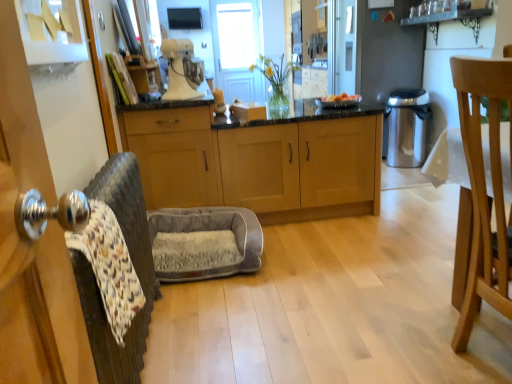
What do you see at coordinates (175, 156) in the screenshot?
I see `matte wood cabinets at center, marked as the second cabinetry in a right-to-left arrangement` at bounding box center [175, 156].

This screenshot has width=512, height=384. Identify the location of patterned fabric swivel chair at left, the second swivel chair in the back-to-front sequence. (135, 268).

The image size is (512, 384). What do you see at coordinates (182, 70) in the screenshot?
I see `white matte stand mixer at upper center` at bounding box center [182, 70].

Identify the location of gray plush pet bed at center, the 1th swivel chair from the back. This screenshot has height=384, width=512. (205, 242).

Identify the location of stainless steel trash can at right. The image size is (512, 384). (407, 126).

Considering the sizes of objects light brown wood cabinets at center, positioned as the 2th cabinetry in left-to-right order, and light brown wooden chair at right in the image provided, who is bigger, light brown wood cabinets at center, positioned as the 2th cabinetry in left-to-right order, or light brown wooden chair at right?

light brown wood cabinets at center, positioned as the 2th cabinetry in left-to-right order.

From a real-world perspective, is light brown wood cabinets at center, positioned as the 2th cabinetry in left-to-right order, located higher than light brown wooden chair at right?

No, from a real-world perspective, light brown wood cabinets at center, positioned as the 2th cabinetry in left-to-right order, is not on top of light brown wooden chair at right.

Where is `chair located below the light brown wood cabinets at center, positioned as the 2th cabinetry in left-to-right order (from the image's perspective)`? chair located below the light brown wood cabinets at center, positioned as the 2th cabinetry in left-to-right order (from the image's perspective) is located at coordinates (484, 189).

Is light brown wood cabinets at center, positioned as the 2th cabinetry in left-to-right order, oriented away from light brown wooden chair at right?

That's right, light brown wood cabinets at center, positioned as the 2th cabinetry in left-to-right order, is facing away from light brown wooden chair at right.

Between patterned fabric swivel chair at left, which is the 1th swivel chair in front-to-back order, and light brown wooden chair at right, which one has smaller width?

With smaller width is patterned fabric swivel chair at left, which is the 1th swivel chair in front-to-back order.

Is patterned fabric swivel chair at left, which is the 1th swivel chair in front-to-back order, inside or outside of light brown wooden chair at right?

patterned fabric swivel chair at left, which is the 1th swivel chair in front-to-back order, exists outside the volume of light brown wooden chair at right.

From a real-world perspective, is patterned fabric swivel chair at left, the second swivel chair in the back-to-front sequence, on light brown wooden chair at right?

Yes, from a real-world perspective, patterned fabric swivel chair at left, the second swivel chair in the back-to-front sequence, is over light brown wooden chair at right

Would you say matte wood cabinets at center, the first cabinetry when ordered from left to right, is a long distance from patterned fabric swivel chair at left, the second swivel chair in the back-to-front sequence?

No, matte wood cabinets at center, the first cabinetry when ordered from left to right, is in close proximity to patterned fabric swivel chair at left, the second swivel chair in the back-to-front sequence.

Is matte wood cabinets at center, marked as the second cabinetry in a right-to-left arrangement, not inside patterned fabric swivel chair at left, which is the 1th swivel chair in front-to-back order?

matte wood cabinets at center, marked as the second cabinetry in a right-to-left arrangement, is positioned outside patterned fabric swivel chair at left, which is the 1th swivel chair in front-to-back order.

From a real-world perspective, is matte wood cabinets at center, the first cabinetry when ordered from left to right, positioned under patterned fabric swivel chair at left, the second swivel chair in the back-to-front sequence, based on gravity?

Correct, in the physical world, matte wood cabinets at center, the first cabinetry when ordered from left to right, is lower than patterned fabric swivel chair at left, the second swivel chair in the back-to-front sequence.

Find the location of a particular element. the 1st cabinetry behind the patterned fabric swivel chair at left, the second swivel chair in the back-to-front sequence, starting your count from the anchor is located at coordinates (175, 156).

Between light brown wood cabinets at center, positioned as the 2th cabinetry in left-to-right order, and matte wood cabinets at center, the first cabinetry when ordered from left to right, which one is positioned in front?

matte wood cabinets at center, the first cabinetry when ordered from left to right, is more forward.

Considering the relative sizes of light brown wood cabinets at center, positioned as the 2th cabinetry in left-to-right order, and matte wood cabinets at center, marked as the second cabinetry in a right-to-left arrangement, in the image provided, is light brown wood cabinets at center, positioned as the 2th cabinetry in left-to-right order, wider than matte wood cabinets at center, marked as the second cabinetry in a right-to-left arrangement,?

Yes.

Which of these two, light brown wood cabinets at center, acting as the first cabinetry starting from the right, or matte wood cabinets at center, marked as the second cabinetry in a right-to-left arrangement, is smaller?

light brown wood cabinets at center, acting as the first cabinetry starting from the right, is smaller.

Is light brown wood cabinets at center, positioned as the 2th cabinetry in left-to-right order, facing away from matte wood cabinets at center, marked as the second cabinetry in a right-to-left arrangement?

No.

How many degrees apart are the facing directions of stainless steel trash can at right and gray plush pet bed at center, which ranks as the second swivel chair in front-to-back order?

88.8 degrees separate the facing orientations of stainless steel trash can at right and gray plush pet bed at center, which ranks as the second swivel chair in front-to-back order.

Between point (419, 101) and point (163, 219), which one is positioned in front?

The point (163, 219) is closer to the camera.

Between stainless steel trash can at right and gray plush pet bed at center, the 1th swivel chair from the back, which one has more height?

stainless steel trash can at right.

Is there a large distance between stainless steel trash can at right and gray plush pet bed at center, the 1th swivel chair from the back?

Absolutely, stainless steel trash can at right is distant from gray plush pet bed at center, the 1th swivel chair from the back.

From the picture: Does stainless steel trash can at right have a lesser height compared to patterned fabric swivel chair at left, which is the 1th swivel chair in front-to-back order?

No.

Is there a large distance between stainless steel trash can at right and patterned fabric swivel chair at left, which is the 1th swivel chair in front-to-back order?

Yes, stainless steel trash can at right and patterned fabric swivel chair at left, which is the 1th swivel chair in front-to-back order, are quite far apart.

From the image's perspective, relative to patterned fabric swivel chair at left, the second swivel chair in the back-to-front sequence, is stainless steel trash can at right above or below?

stainless steel trash can at right is situated higher than patterned fabric swivel chair at left, the second swivel chair in the back-to-front sequence, in the image.

Can you confirm if stainless steel trash can at right is thinner than patterned fabric swivel chair at left, the second swivel chair in the back-to-front sequence?

No, stainless steel trash can at right is not thinner than patterned fabric swivel chair at left, the second swivel chair in the back-to-front sequence.

Which of these two, stainless steel trash can at right or light brown wood cabinets at center, positioned as the 2th cabinetry in left-to-right order, is wider?

light brown wood cabinets at center, positioned as the 2th cabinetry in left-to-right order, is wider.

Does point (415, 89) lie in front of point (320, 191)?

No.

Would you say stainless steel trash can at right is to the left or to the right of light brown wood cabinets at center, positioned as the 2th cabinetry in left-to-right order, in the picture?

Based on their positions, stainless steel trash can at right is located to the right of light brown wood cabinets at center, positioned as the 2th cabinetry in left-to-right order.

In the image, there is a light brown wood cabinets at center, acting as the first cabinetry starting from the right. Where is `appliance above it (from the image's perspective)`? This screenshot has height=384, width=512. appliance above it (from the image's perspective) is located at coordinates (407, 126).

Starting from the light brown wooden chair at right, which cabinetry is the 1st one to the left? Please provide its 2D coordinates.

[(300, 164)]

Where is `the 1st swivel chair below when counting from the light brown wooden chair at right (from the image's perspective)`? Image resolution: width=512 pixels, height=384 pixels. the 1st swivel chair below when counting from the light brown wooden chair at right (from the image's perspective) is located at coordinates (135, 268).

Looking at this image, from the image, which object appears to be nearer to gray plush pet bed at center, the 1th swivel chair from the back, stainless steel trash can at right or patterned fabric swivel chair at left, which is the 1th swivel chair in front-to-back order?

patterned fabric swivel chair at left, which is the 1th swivel chair in front-to-back order, is positioned closer to the anchor gray plush pet bed at center, the 1th swivel chair from the back.

From the image, which object appears to be farther from light brown wood cabinets at center, positioned as the 2th cabinetry in left-to-right order, gray plush pet bed at center, which ranks as the second swivel chair in front-to-back order, or patterned fabric swivel chair at left, the second swivel chair in the back-to-front sequence?

patterned fabric swivel chair at left, the second swivel chair in the back-to-front sequence.

When comparing their distances from light brown wood cabinets at center, acting as the first cabinetry starting from the right, does light brown wooden chair at right or matte wood cabinets at center, marked as the second cabinetry in a right-to-left arrangement, seem further?

light brown wooden chair at right.

In the scene shown: Considering their positions, is light brown wood cabinets at center, acting as the first cabinetry starting from the right, positioned further to matte wood cabinets at center, the first cabinetry when ordered from left to right, than stainless steel trash can at right?

stainless steel trash can at right is further to matte wood cabinets at center, the first cabinetry when ordered from left to right.

Considering their positions, is light brown wood cabinets at center, positioned as the 2th cabinetry in left-to-right order, positioned closer to patterned fabric swivel chair at left, the second swivel chair in the back-to-front sequence, than stainless steel trash can at right?

light brown wood cabinets at center, positioned as the 2th cabinetry in left-to-right order.

From the image, which object appears to be nearer to white matte stand mixer at upper center, light brown wooden chair at right or matte wood cabinets at center, marked as the second cabinetry in a right-to-left arrangement?

Among the two, matte wood cabinets at center, marked as the second cabinetry in a right-to-left arrangement, is located nearer to white matte stand mixer at upper center.

In the scene shown: Which object lies further to the anchor point gray plush pet bed at center, the 1th swivel chair from the back, patterned fabric swivel chair at left, the second swivel chair in the back-to-front sequence, or matte wood cabinets at center, the first cabinetry when ordered from left to right?

patterned fabric swivel chair at left, the second swivel chair in the back-to-front sequence, is positioned further to the anchor gray plush pet bed at center, the 1th swivel chair from the back.

From the image, which object appears to be farther from white matte stand mixer at upper center, light brown wood cabinets at center, positioned as the 2th cabinetry in left-to-right order, or matte wood cabinets at center, the first cabinetry when ordered from left to right?

The object further to white matte stand mixer at upper center is light brown wood cabinets at center, positioned as the 2th cabinetry in left-to-right order.

Find the location of a particular element. The width and height of the screenshot is (512, 384). coffee machine positioned between patterned fabric swivel chair at left, the second swivel chair in the back-to-front sequence, and matte wood cabinets at center, marked as the second cabinetry in a right-to-left arrangement, from near to far is located at coordinates (182, 70).

Locate an element on the screen. The height and width of the screenshot is (384, 512). swivel chair between patterned fabric swivel chair at left, the second swivel chair in the back-to-front sequence, and light brown wooden chair at right from left to right is located at coordinates (205, 242).

You are a GUI agent. You are given a task and a screenshot of the screen. Output one action in this format:
    pyautogui.click(x=<x>, y=<y>)
    Task: Click on the coffee machine between light brown wooden chair at right and matte wood cabinets at center, the first cabinetry when ordered from left to right, from front to back
    Image resolution: width=512 pixels, height=384 pixels.
    Given the screenshot: What is the action you would take?
    pyautogui.click(x=182, y=70)

Find the location of a particular element. Image resolution: width=512 pixels, height=384 pixels. cabinetry situated between white matte stand mixer at upper center and stainless steel trash can at right from left to right is located at coordinates (300, 164).